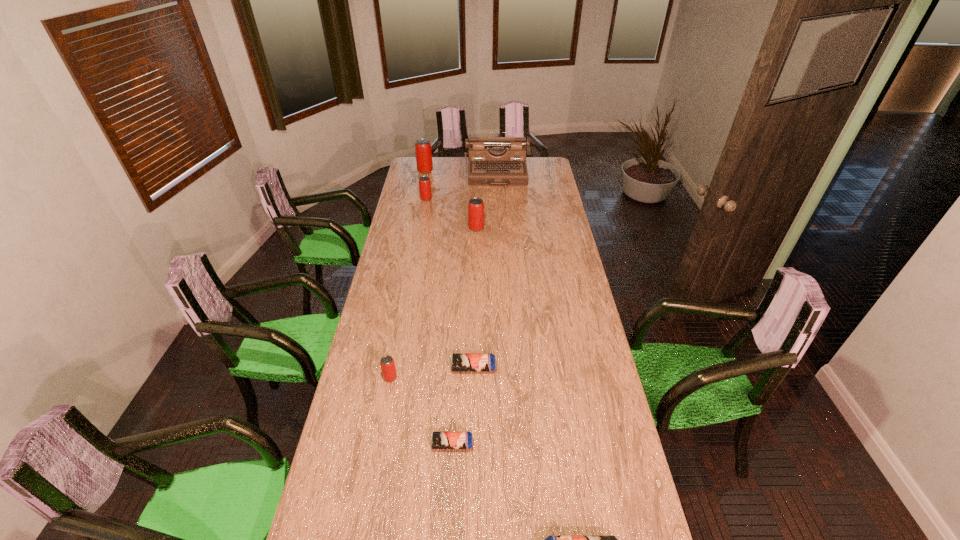
In order to click on the second biggest blue beer can in this screenshot , I will do `click(459, 362)`.

At what (x,y) coordinates should I click in order to perform the action: click on the shortest object. Please return your answer as a coordinate pair (x, y). Looking at the image, I should click on (439, 440).

The height and width of the screenshot is (540, 960). In order to click on the shortest beer can in this screenshot , I will do `click(439, 440)`.

The image size is (960, 540). What are the coordinates of `vacant space situated 0.340m on the keyboard of the typewriter` in the screenshot? It's located at (500, 221).

The width and height of the screenshot is (960, 540). Identify the location of free space located on the back of the farthest pink beer can. (427, 160).

This screenshot has height=540, width=960. Identify the location of free point located on the left of the sixth shortest beer can. (430, 228).

Locate an element on the screen. Image resolution: width=960 pixels, height=540 pixels. vacant position located on the front of the second farthest beer can is located at coordinates (421, 224).

Find the location of a particular element. This screenshot has height=540, width=960. vacant space located 0.080m on the right of the smallest pink beer can is located at coordinates (420, 377).

You are a GUI agent. You are given a task and a screenshot of the screen. Output one action in this format:
    pyautogui.click(x=<x>, y=<y>)
    Task: Click on the blank space located 0.150m on the left of the second shortest beer can
    Image resolution: width=960 pixels, height=540 pixels.
    Given the screenshot: What is the action you would take?
    pyautogui.click(x=411, y=368)

The image size is (960, 540). I want to click on vacant space located 0.140m on the left of the shortest object, so click(388, 444).